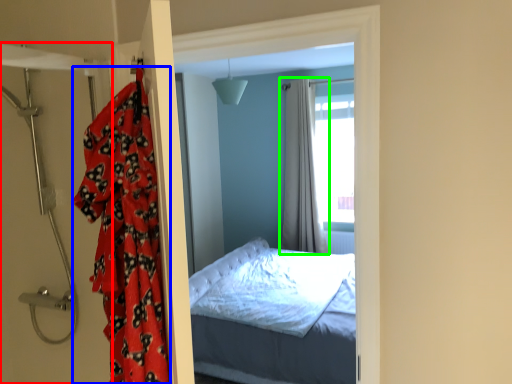
Question: Which object is positioned farthest from door (highlighted by a red box)? Select from blanket (highlighted by a blue box) and curtain (highlighted by a green box).

Choices:
 (A) blanket
 (B) curtain

Answer: (B)